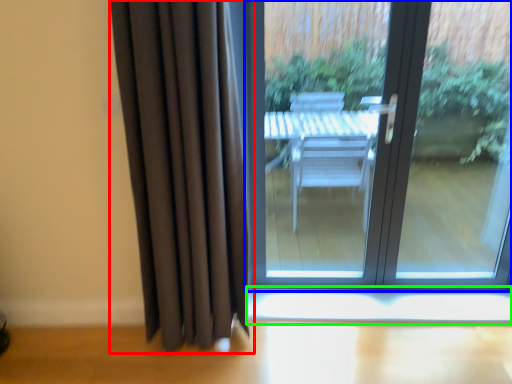
Question: Considering the real-world distances, which object is farthest from curtain (highlighted by a red box)? door (highlighted by a blue box) or window sill (highlighted by a green box)?

Choices:
 (A) door
 (B) window sill

Answer: (A)